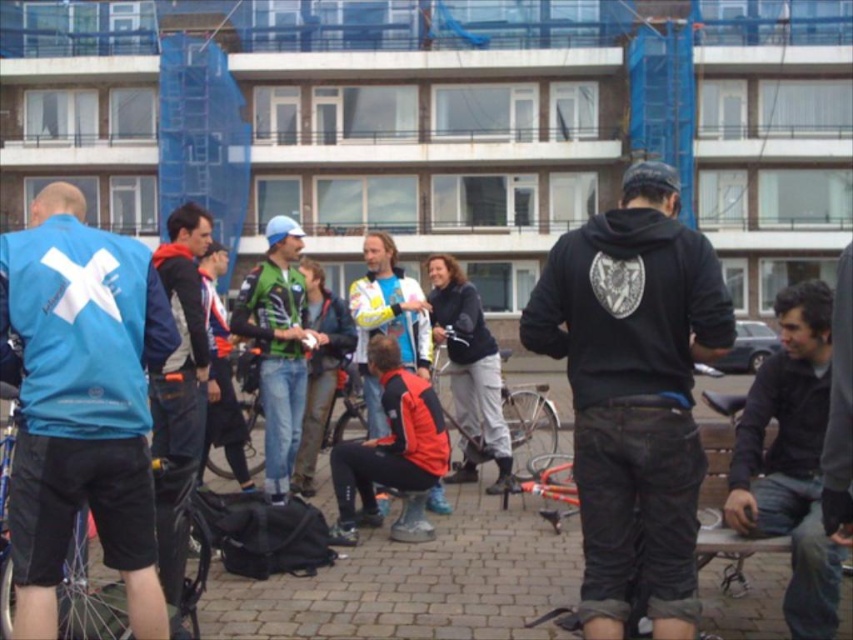
Which is behind, point (33, 564) or point (260, 280)?

The point (260, 280) is behind.

Can you confirm if matte blue jacket at left is positioned below green fabric jacket at center?

Yes, matte blue jacket at left is below green fabric jacket at center.

Does point (113, 496) lie behind point (287, 368)?

No, (113, 496) is in front of (287, 368).

Image resolution: width=853 pixels, height=640 pixels. I want to click on matte blue jacket at left, so click(82, 404).

Which is more to the left, dark blue jacket at center or silver metallic bicycle at center?

dark blue jacket at center is more to the left.

Which is more to the right, dark blue jacket at center or silver metallic bicycle at center?

Positioned to the right is silver metallic bicycle at center.

You are a GUI agent. You are given a task and a screenshot of the screen. Output one action in this format:
    pyautogui.click(x=<x>, y=<y>)
    Task: Click on the dark blue jacket at center
    The height and width of the screenshot is (640, 853).
    Given the screenshot: What is the action you would take?
    pyautogui.click(x=178, y=396)

Which of these two, dark gray cotton jacket at lower right or green fabric jacket at center, stands taller?

green fabric jacket at center is taller.

Who is more distant from viewer, (784, 307) or (265, 456)?

The point (265, 456) is behind.

Where is `dark gray cotton jacket at lower right`? dark gray cotton jacket at lower right is located at coordinates (790, 458).